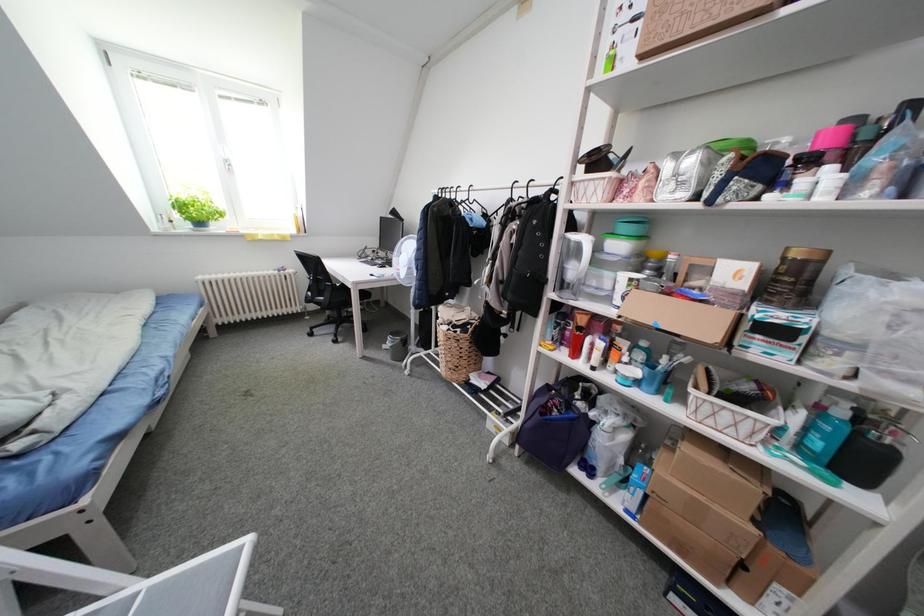
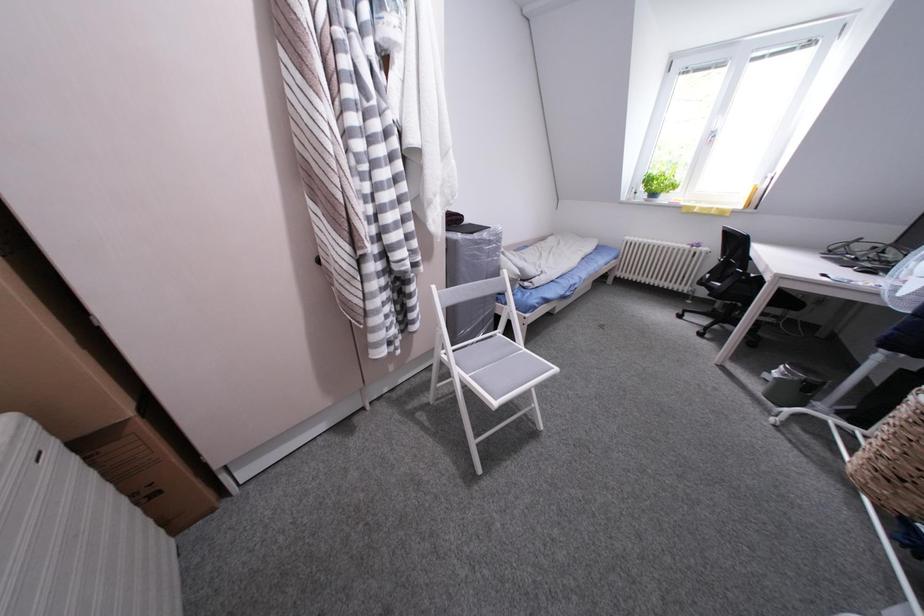
The images are taken continuously from a first-person perspective. In which direction is your viewpoint rotating?

The camera's rotation is toward left-down.